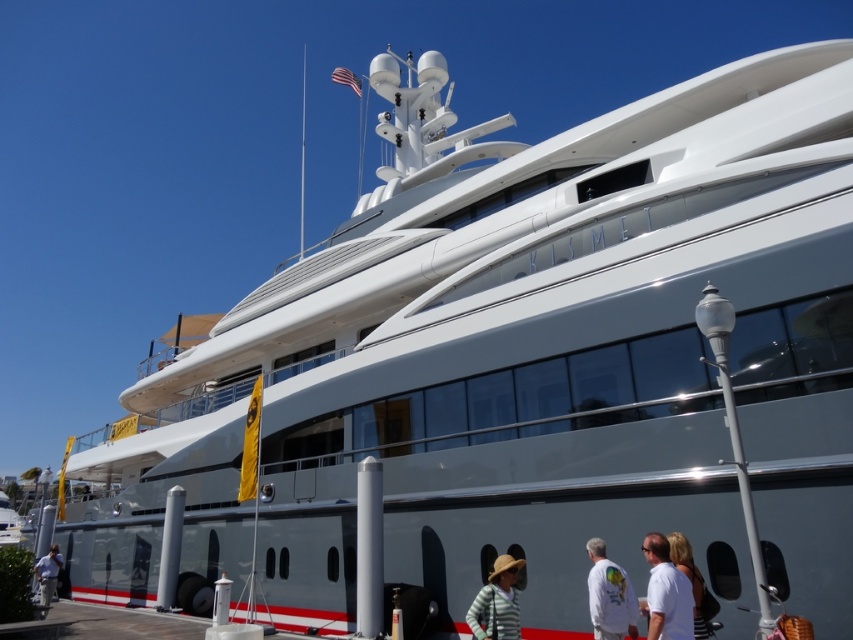
You are a photographer on the dock and want to capture both the striped fabric hat at lower center and the blonde hair at lower right in the same frame. Based on their positions, which object is wider and might require more space in the shot?

The striped fabric hat at lower center might be wider than blonde hair at lower right, so it would require more space in the shot.

You are standing on the dock and see the striped fabric hat at lower center. If you want to locate it precisely, what are its coordinates?

The striped fabric hat at lower center is located at coordinates point (497, 602).